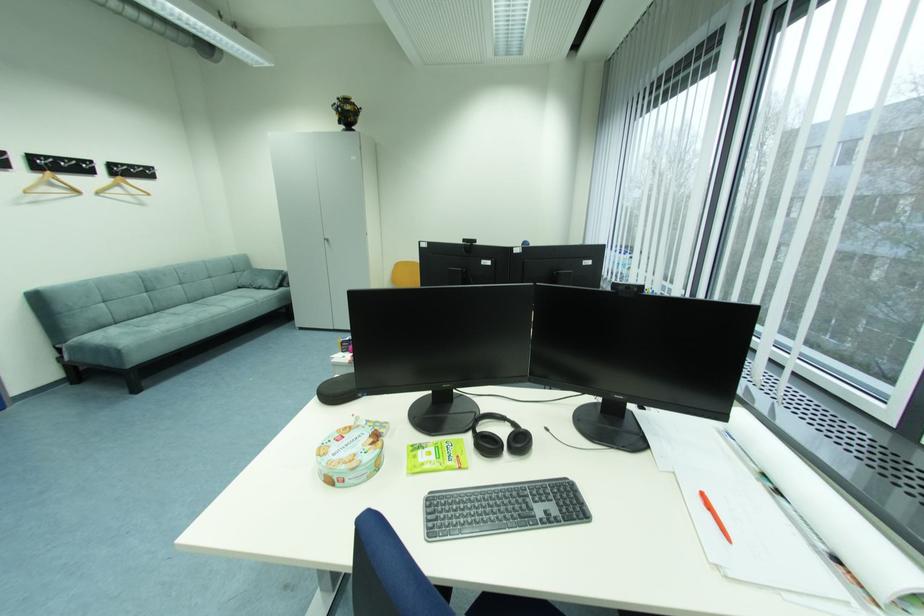
Find where to lift the orange pen. Please return your answer as a coordinate pair (x, y).

(714, 516)